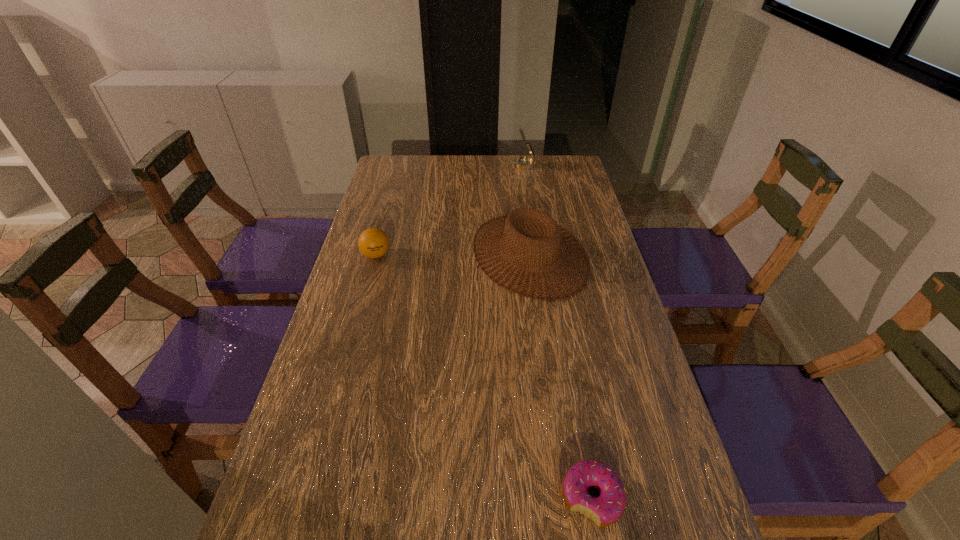
In order to click on blank region between the compass and the shortest object in this screenshot , I will do `click(558, 332)`.

Locate an element on the screen. This screenshot has width=960, height=540. vacant space that is in between the tallest object and the doughnut is located at coordinates (561, 376).

Identify the location of free space between the ping-pong ball and the doughnut. Image resolution: width=960 pixels, height=540 pixels. (484, 376).

What are the coordinates of `vacant space in between the ping-pong ball and the nearest object` in the screenshot? It's located at (484, 376).

At what (x,y) coordinates should I click in order to perform the action: click on object identified as the closest to the ping-pong ball. Please return your answer as a coordinate pair (x, y). The width and height of the screenshot is (960, 540). Looking at the image, I should click on (528, 222).

Identify which object is located as the nearest to the compass. Please provide its 2D coordinates. Your answer should be formatted as a tuple, i.e. [(x, y)], where the tuple contains the x and y coordinates of a point satisfying the conditions above.

[(528, 222)]

Locate an element on the screen. free space that satisfies the following two spatial constraints: 1. on the side with brand of the doughnut; 2. on the left side of the leftmost object is located at coordinates (309, 498).

Where is `blank area in the image that satisfies the following two spatial constraints: 1. on the front side of the sunhat; 2. on the left side of the doughnut`? This screenshot has height=540, width=960. blank area in the image that satisfies the following two spatial constraints: 1. on the front side of the sunhat; 2. on the left side of the doughnut is located at coordinates (563, 498).

Locate an element on the screen. The height and width of the screenshot is (540, 960). blank space that satisfies the following two spatial constraints: 1. with the dial facing the compass; 2. on the left side of the doughnut is located at coordinates (573, 498).